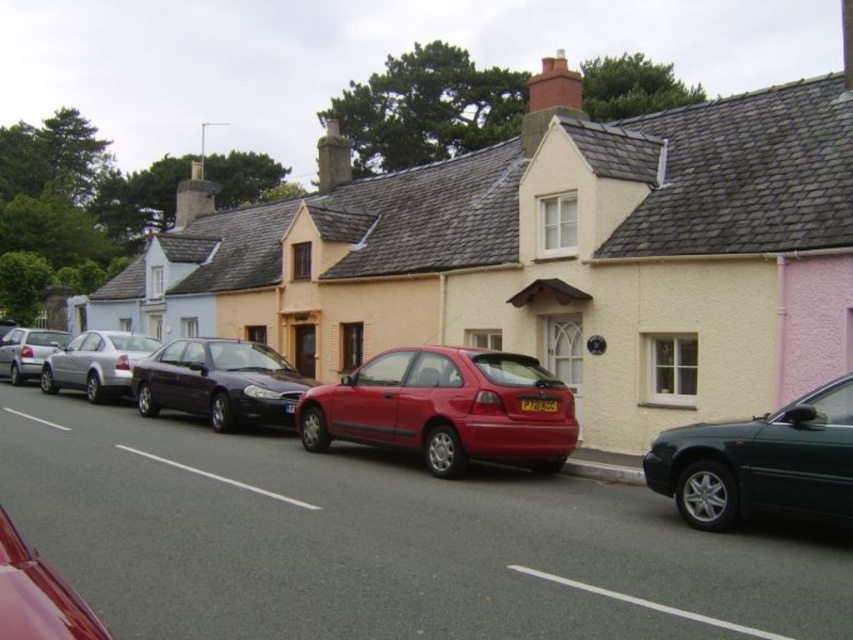
Between metallic dark green sedan at right and silver metallic sedan at center, which one is positioned lower?

metallic dark green sedan at right is lower down.

Is point (735, 460) positioned before point (109, 392)?

Yes, it is.

Where is `metallic dark green sedan at right`? The width and height of the screenshot is (853, 640). metallic dark green sedan at right is located at coordinates (x=759, y=461).

Which is below, shiny black sedan at center or black plastic license plate at center?

black plastic license plate at center is lower down.

Is shiny black sedan at center wider than black plastic license plate at center?

Yes.

Is point (233, 356) closer to viewer compared to point (550, 404)?

No.

Where is `shiny black sedan at center`? The width and height of the screenshot is (853, 640). shiny black sedan at center is located at coordinates (219, 381).

This screenshot has height=640, width=853. Describe the element at coordinates (444, 408) in the screenshot. I see `metallic red hatchback at center` at that location.

Does metallic red hatchback at center appear on the right side of silver metallic sedan at center?

Yes, metallic red hatchback at center is to the right of silver metallic sedan at center.

Does point (494, 460) lie in front of point (120, 376)?

Yes, point (494, 460) is in front of point (120, 376).

The image size is (853, 640). Identify the location of metallic red hatchback at center. (444, 408).